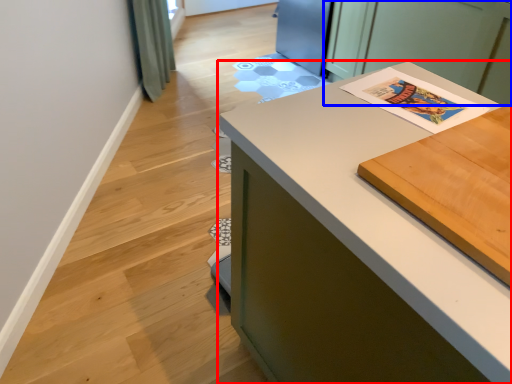
Question: Among these objects, which one is nearest to the camera, countertop (highlighted by a red box) or cabinetry (highlighted by a blue box)?

Choices:
 (A) countertop
 (B) cabinetry

Answer: (A)